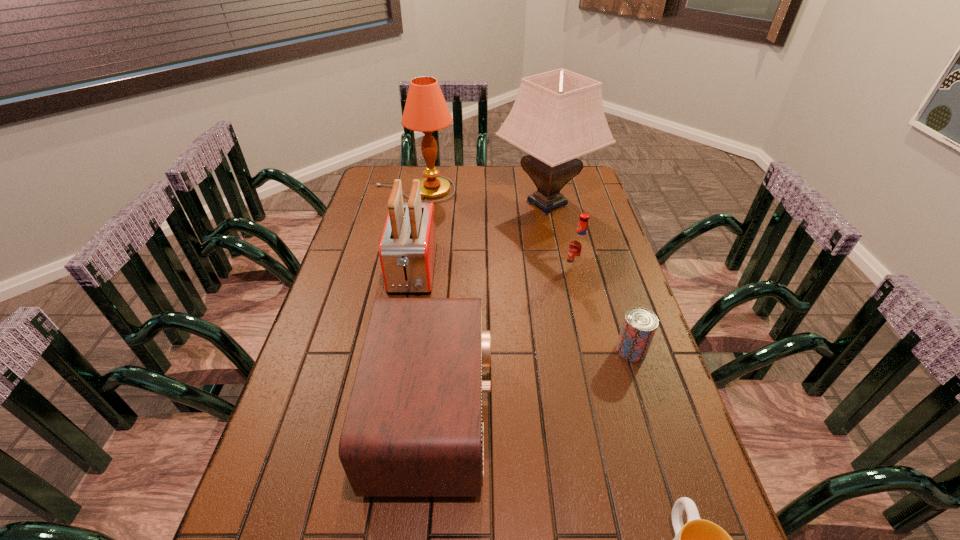
The width and height of the screenshot is (960, 540). I want to click on free space at the far edge, so click(x=509, y=172).

In the image, there is a desktop. Where is `vacant space at the left edge`? This screenshot has height=540, width=960. vacant space at the left edge is located at coordinates (335, 455).

In the image, there is a desktop. Where is `vacant space at the right edge`? The width and height of the screenshot is (960, 540). vacant space at the right edge is located at coordinates (647, 469).

Locate an element on the screen. This screenshot has height=540, width=960. vacant space at the far right corner of the desktop is located at coordinates (575, 190).

Locate an element on the screen. empty space that is in between the third tallest object and the root beer is located at coordinates (493, 271).

This screenshot has height=540, width=960. In order to click on vacant area that lies between the beer can and the third tallest object in this screenshot , I will do `click(522, 310)`.

I want to click on free point between the radio receiver and the lampshade, so click(490, 310).

Image resolution: width=960 pixels, height=540 pixels. In order to click on free space between the root beer and the beer can in this screenshot , I will do `click(603, 311)`.

The height and width of the screenshot is (540, 960). In order to click on vacant space in between the radio receiver and the beer can in this screenshot , I will do `click(532, 383)`.

Identify the location of empty space that is in between the lamp and the root beer. The height and width of the screenshot is (540, 960). (494, 231).